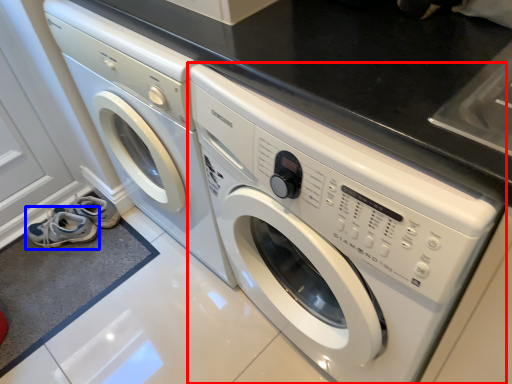
Question: Which point is closer to the camera, washing machine (highlighted by a red box) or shoe (highlighted by a blue box)?

Choices:
 (A) washing machine
 (B) shoe

Answer: (A)